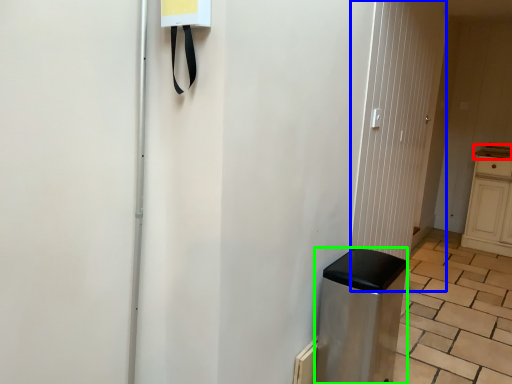
Question: Which is farther away from counter top (highlighted by a red box)? screen door (highlighted by a blue box) or appliance (highlighted by a green box)?

Choices:
 (A) screen door
 (B) appliance

Answer: (B)